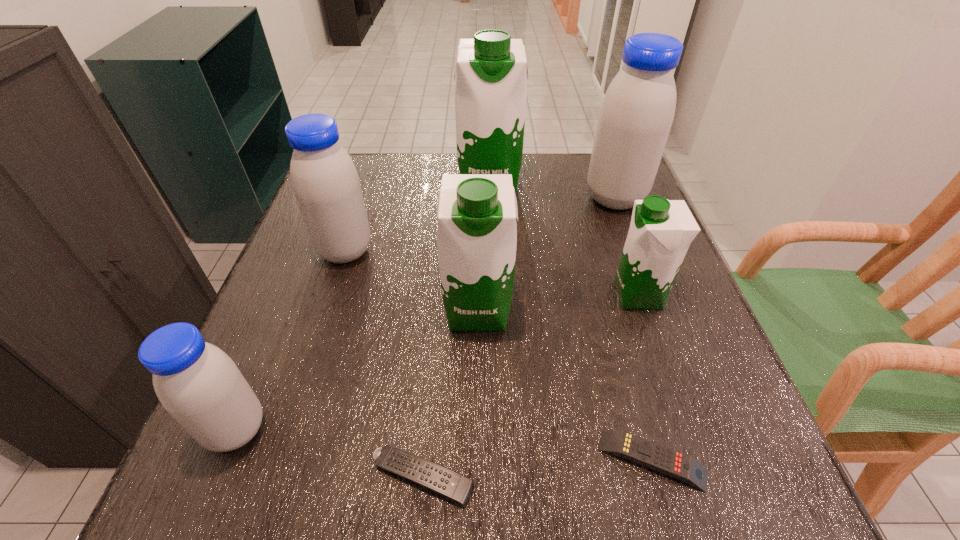
Find the location of a particular element. The width and height of the screenshot is (960, 540). the left remote control is located at coordinates (456, 487).

This screenshot has height=540, width=960. Find the location of `free spot located on the front-facing side of the farthest green soya milk`. free spot located on the front-facing side of the farthest green soya milk is located at coordinates (491, 244).

Where is `blank space located 0.310m on the front of the rightmost blue soya milk`? blank space located 0.310m on the front of the rightmost blue soya milk is located at coordinates (659, 315).

This screenshot has width=960, height=540. In order to click on vacant space located on the back of the second nearest blue soya milk in this screenshot , I will do `click(372, 167)`.

Image resolution: width=960 pixels, height=540 pixels. I want to click on vacant area situated 0.080m on the front-facing side of the second biggest green soya milk, so click(477, 375).

Where is `free space located on the front-facing side of the smallest green soya milk`? This screenshot has height=540, width=960. free space located on the front-facing side of the smallest green soya milk is located at coordinates (x=503, y=295).

This screenshot has height=540, width=960. I want to click on free space located 0.400m on the front-facing side of the smallest green soya milk, so click(414, 295).

Image resolution: width=960 pixels, height=540 pixels. Identify the location of vacant space located 0.190m on the front-facing side of the smallest green soya milk. (518, 295).

You are a GUI agent. You are given a task and a screenshot of the screen. Output one action in this format:
    pyautogui.click(x=<x>, y=<y>)
    Task: Click on the free spot located on the front of the nearest soya milk
    Image resolution: width=960 pixels, height=540 pixels.
    Given the screenshot: What is the action you would take?
    pyautogui.click(x=206, y=503)

Locate an element on the screen. blank space located 0.190m on the back of the right remote control is located at coordinates (617, 333).